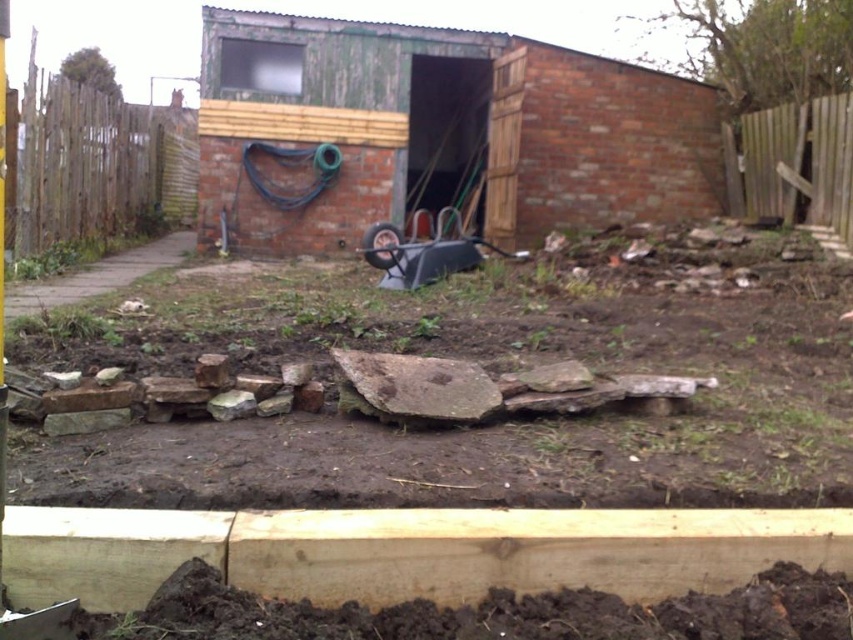
You are standing in the backyard and want to enter the green weathered shed at center. To do so, you need to walk around the wooden fence at left. Which direction should you walk to reach the shed from the fence?

The green weathered shed at center is located above the wooden fence at left, so you should walk towards the direction where the shed is positioned higher than the fence to reach it.

You are planning to install a new fence panel between the wooden fence at left and the wooden fence at right. Based on the scene, which fence section is wider and should you consider the width when choosing the panel size?

The wooden fence at left might be wider than wooden fence at right, so you should consider the width difference when choosing the panel size to ensure proper fit.